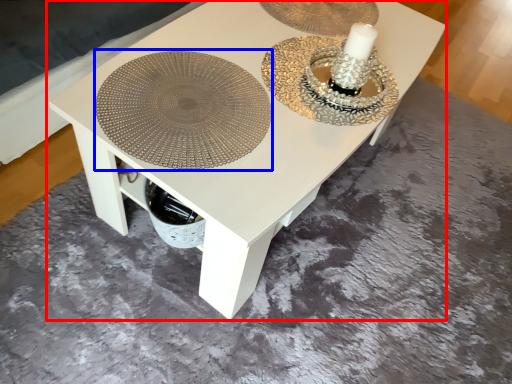
Question: Which point is further to the camera, table (highlighted by a red box) or platter (highlighted by a blue box)?

Choices:
 (A) table
 (B) platter

Answer: (B)